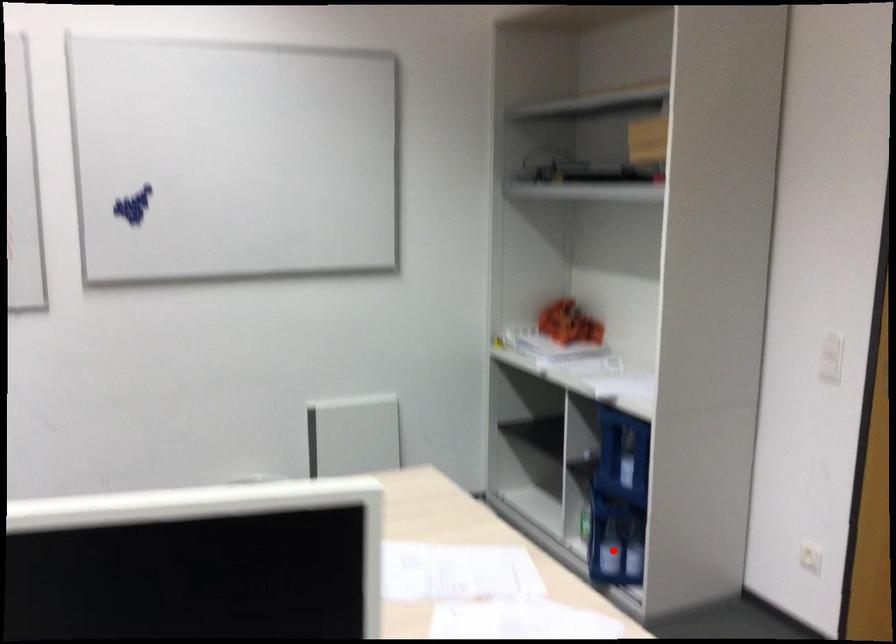
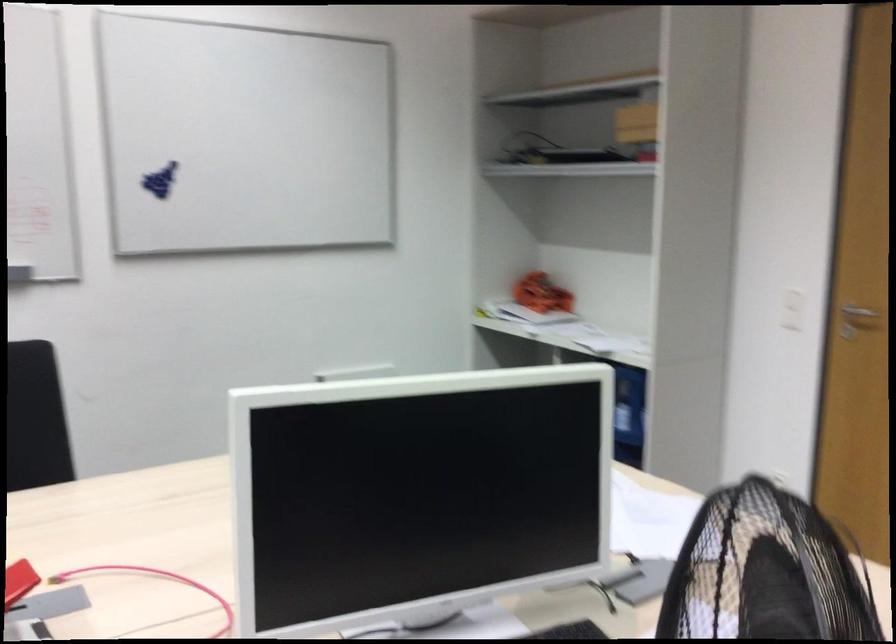
Question: I am providing you with two images of the same scene from different viewpoints. A red point is marked on the first image. Is the red point's position out of view in image 2?

Choices:
 (A) Yes
 (B) No

Answer: (A)